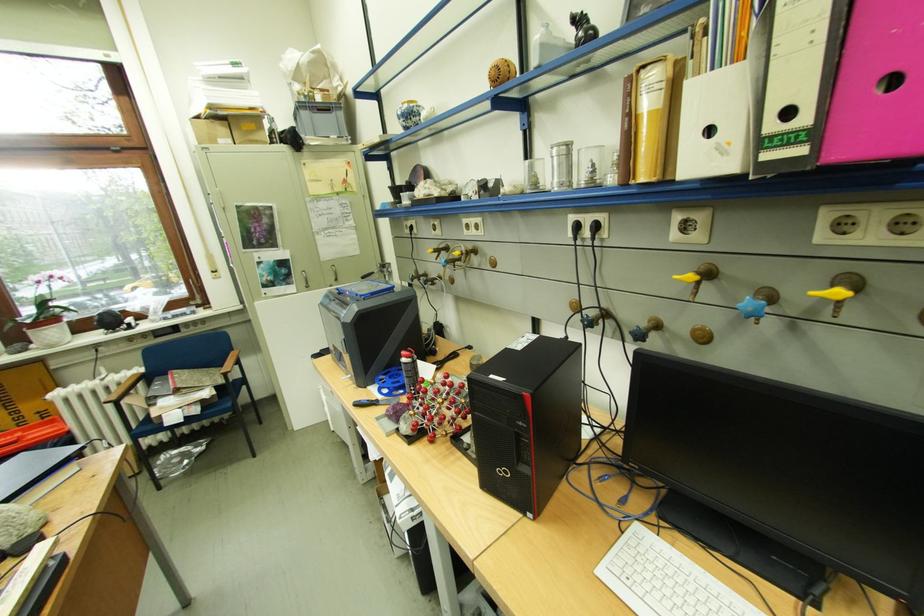
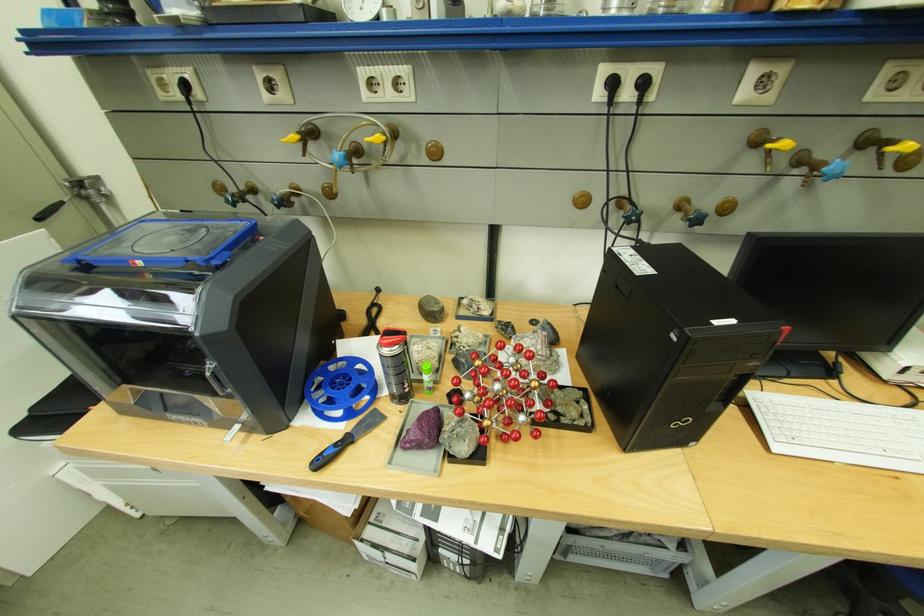
In the second image, find the point that corresponds to (371,297) in the first image.

(219, 261)